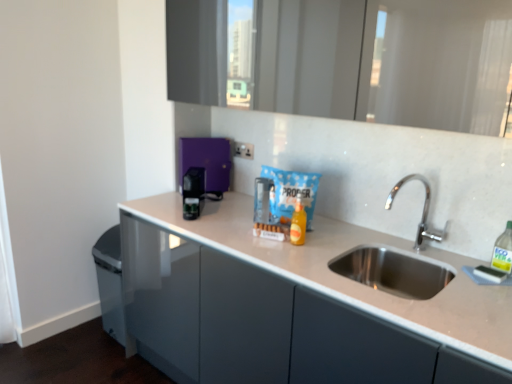
Where is `free location in front of black plastic coffee machine at center, the 1th appliance in the front-to-back sequence`? free location in front of black plastic coffee machine at center, the 1th appliance in the front-to-back sequence is located at coordinates (192, 225).